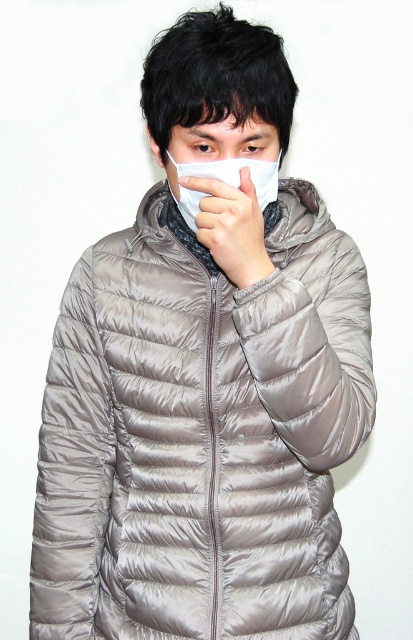
You are a photographer trying to capture a closeup of the white matte mask at center. The camera lens is 34 inches away from the mask. Will the mask be in focus if the depth of field allows objects within 34 inches to be sharp?

The white matte mask at center is 34.45 inches away from the viewer. Since the depth of field allows objects within 34 inches to be sharp, the mask will be slightly out of focus because it is 0.45 inches beyond the 34 inch limit.

You are a photographer adjusting the composition of your shot. You need to ensure that the white matte mask at center and the white matte handkerchief at center are positioned symmetrically around the center point. Which object should you move to the right to achieve this symmetry?

The white matte mask at center should be moved to the right to achieve symmetry since it is currently positioned to the left of the white matte handkerchief at center.

You are a fashion designer creating a new line of accessories. You have a white matte handkerchief at center and a matte white nose at center in front of you. Which one can you use to cover the nose area more effectively?

The white matte handkerchief at center is larger in size than the matte white nose at center, so it can cover the nose area more effectively.